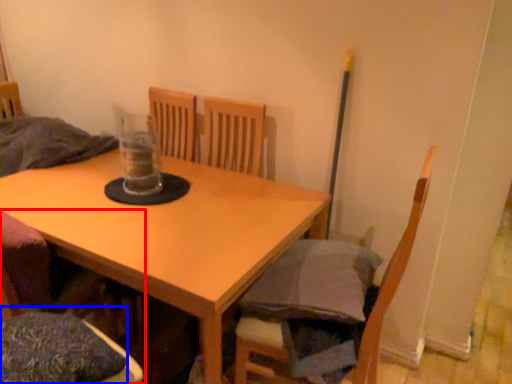
Question: Which point is closer to the camera, chair (highlighted by a red box) or pillow (highlighted by a blue box)?

Choices:
 (A) chair
 (B) pillow

Answer: (A)